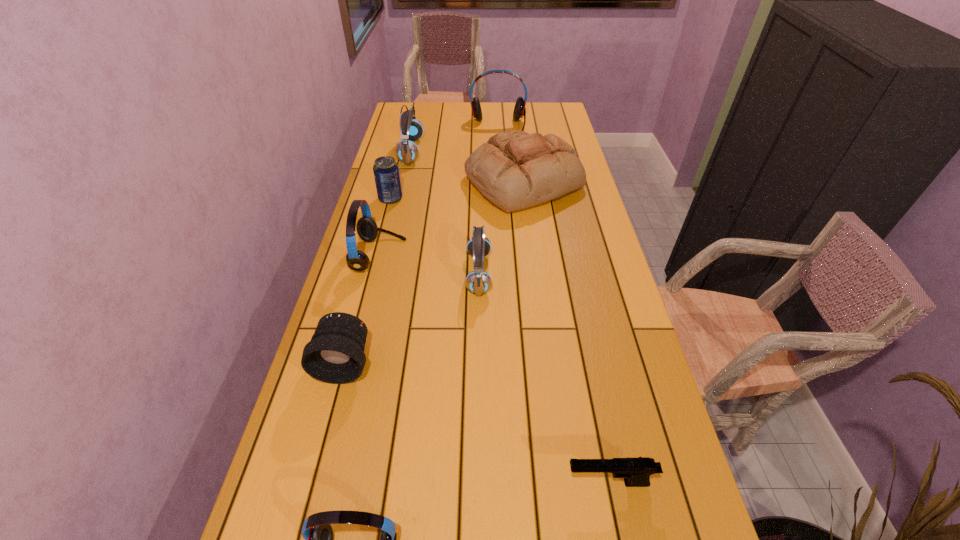
Where is `free space located 0.240m on the front-facing side of the black pistol`? free space located 0.240m on the front-facing side of the black pistol is located at coordinates (442, 483).

You are a GUI agent. You are given a task and a screenshot of the screen. Output one action in this format:
    pyautogui.click(x=<x>, y=<y>)
    Task: Click on the vacant area located on the front-facing side of the black pistol
    
    Given the screenshot: What is the action you would take?
    pyautogui.click(x=493, y=483)

This screenshot has width=960, height=540. Identify the location of vacant point located on the front-facing side of the black pistol. (518, 483).

The image size is (960, 540). I want to click on object situated at the far edge, so click(x=519, y=110).

I want to click on soda that is at the left edge, so click(386, 171).

Where is `telephoto lens located at the left edge`? This screenshot has height=540, width=960. telephoto lens located at the left edge is located at coordinates (335, 354).

Where is `bread at the right edge`? The image size is (960, 540). bread at the right edge is located at coordinates (515, 170).

The height and width of the screenshot is (540, 960). What are the coordinates of `pistol that is at the right edge` in the screenshot? It's located at (636, 471).

This screenshot has width=960, height=540. What are the coordinates of `free space at the far edge of the desktop` in the screenshot? It's located at (462, 104).

This screenshot has height=540, width=960. In the image, there is a desktop. What are the coordinates of `vacant space at the left edge` in the screenshot? It's located at coord(367,280).